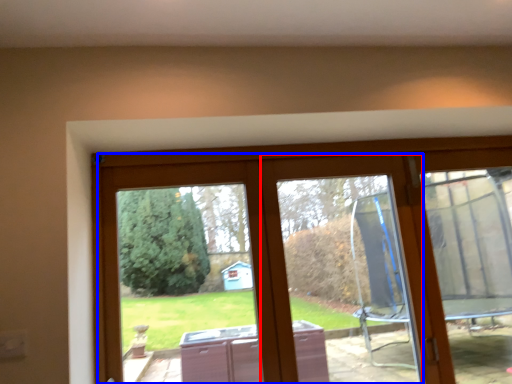
Question: Which object appears farthest to the camera in this image, window frame (highlighted by a red box) or glass door (highlighted by a blue box)?

Choices:
 (A) window frame
 (B) glass door

Answer: (A)